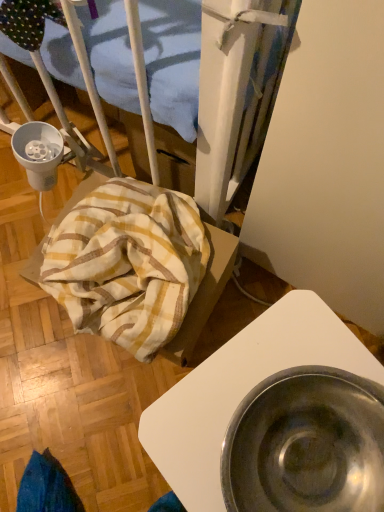
At what (x,y) coordinates should I click in order to perform the action: click on empty space that is ontop of metallic silver bowl at lower right (from a real-world perspective). Please return your answer as a coordinate pair (x, y). The width and height of the screenshot is (384, 512). Looking at the image, I should click on (278, 431).